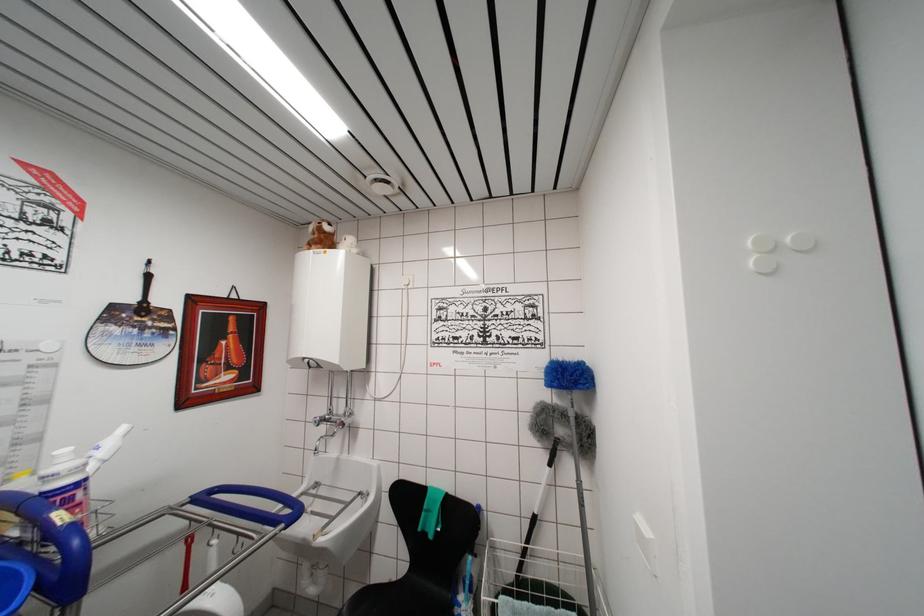
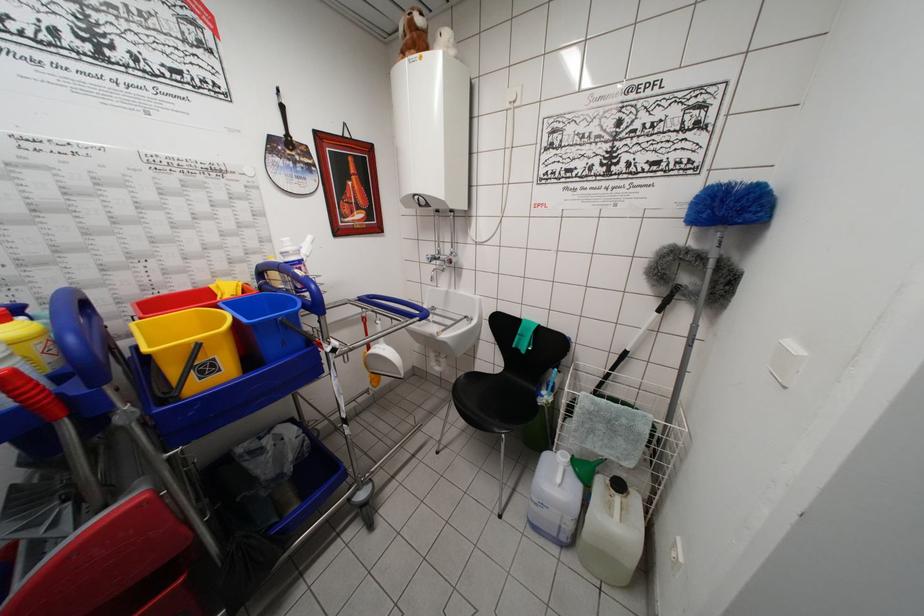
Locate, in the second image, the point that corresponds to point (391, 586) in the first image.

(491, 379)